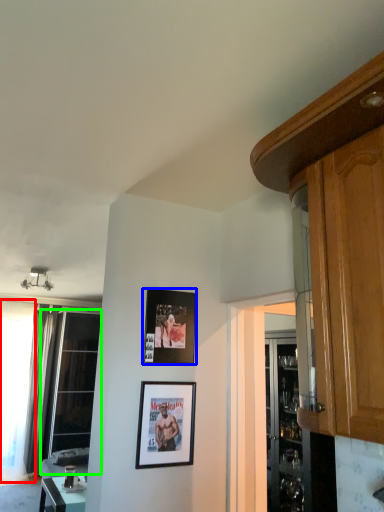
Question: Based on their relative distances, which object is nearer to window (highlighted by a red box)? Choose from picture frame (highlighted by a blue box) and window (highlighted by a green box).

Choices:
 (A) picture frame
 (B) window

Answer: (B)